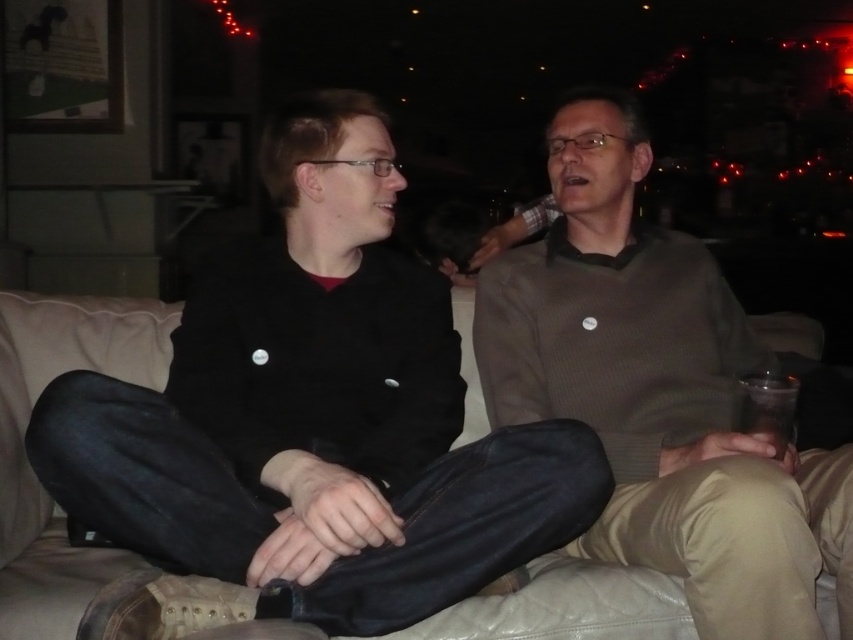
Based on the photo, you are a bartender preparing drinks for a party. You need to place a transparent plastic cup at lower right on a shelf that can only hold items below the height of the black matte jacket at center. Will the cup fit under the jacket?

The black matte jacket at center is above the transparent plastic cup at lower right, so the cup is positioned lower than the jacket. Since the shelf can only hold items below the jacket, the transparent plastic cup at lower right will fit under the black matte jacket at center.

You are a delivery person who needs to place a small package on the couch where the black matte jacket at center and transparent plastic cup at lower right are located. Can you fit the package between them without moving either item?

The black matte jacket at center is larger than the transparent plastic cup at lower right, so there might be limited space between them. However, since the package is small, it could potentially fit depending on the exact dimensions of the space available.

You are designing a new living room layout and want to place a decorative pillow between the matte brown sweater at center and the beige leather couch at center. Based on their sizes, which object should the pillow be closer to?

The matte brown sweater at center is wider than the beige leather couch at center, so the pillow should be placed closer to the beige leather couch at center to balance the sizes.